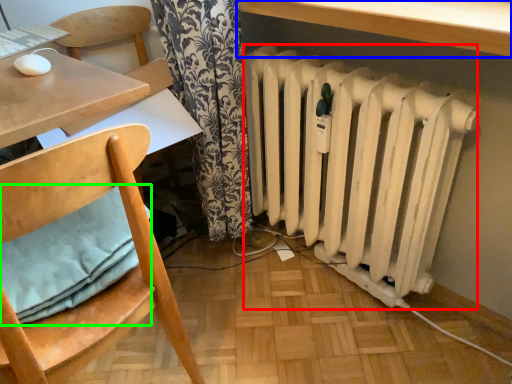
Question: Based on their relative distances, which object is farther from radiator (highlighted by a red box)? Choose from table (highlighted by a blue box) and pillow (highlighted by a green box).

Choices:
 (A) table
 (B) pillow

Answer: (B)